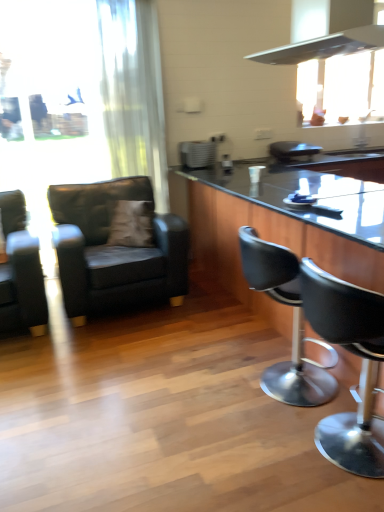
You are a GUI agent. You are given a task and a screenshot of the screen. Output one action in this format:
    pyautogui.click(x=<x>, y=<y>)
    Task: Click on the free area behind black leather bar stool at center, the third chair from the left
    
    Given the screenshot: What is the action you would take?
    pyautogui.click(x=245, y=344)